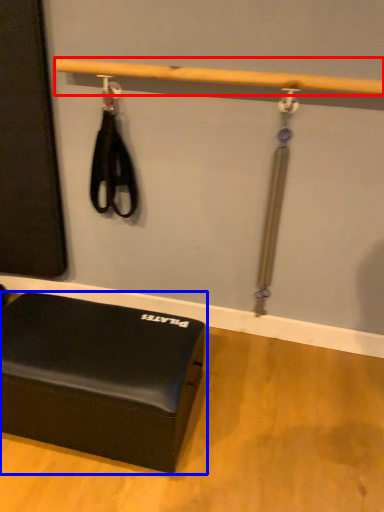
Question: Which point is further to the camera, beam (highlighted by a red box) or furniture (highlighted by a blue box)?

Choices:
 (A) beam
 (B) furniture

Answer: (A)